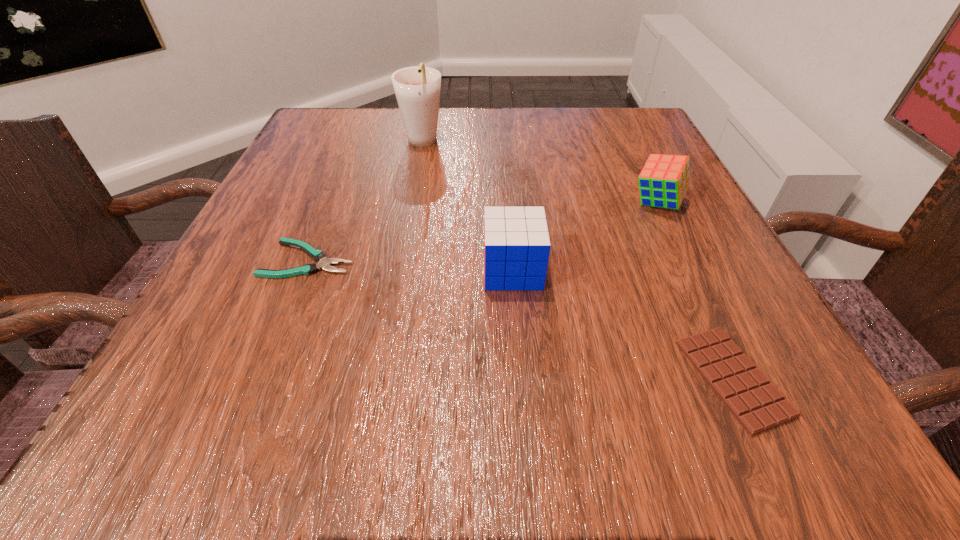
The image size is (960, 540). What are the coordinates of `root beer` in the screenshot? It's located at (417, 89).

Locate an element on the screen. This screenshot has height=540, width=960. the farthest object is located at coordinates (417, 89).

What are the coordinates of `the right cube` in the screenshot? It's located at click(664, 180).

This screenshot has height=540, width=960. What are the coordinates of `the fourth nearest object` in the screenshot? It's located at (664, 180).

Locate an element on the screen. The image size is (960, 540). the nearer cube is located at coordinates (516, 241).

This screenshot has width=960, height=540. What are the coordinates of `the third object from right to left` in the screenshot? It's located at (516, 241).

Find the location of a particular element. The width and height of the screenshot is (960, 540). the leftmost object is located at coordinates (318, 255).

This screenshot has width=960, height=540. What are the coordinates of `the nearest object` in the screenshot? It's located at (757, 404).

You are a GUI agent. You are given a task and a screenshot of the screen. Output one action in this format:
    pyautogui.click(x=<x>, y=<y>)
    Task: Click on the vacant space located on the drink side of the tallest object
    
    Given the screenshot: What is the action you would take?
    pyautogui.click(x=413, y=192)

In order to click on free point located 0.210m on the front of the right cube in this screenshot , I will do `click(709, 310)`.